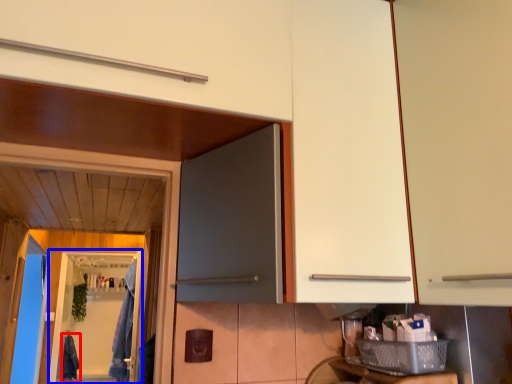
Question: Which object appears farthest to the camera in this image, laundry (highlighted by a red box) or screen door (highlighted by a blue box)?

Choices:
 (A) laundry
 (B) screen door

Answer: (A)